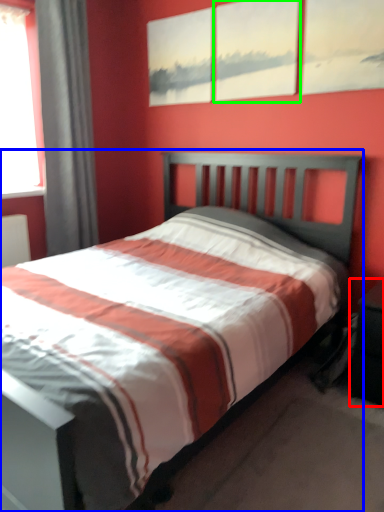
Question: Which is nearer to the nightstand (highlighted by a red box)? bed (highlighted by a blue box) or picture frame (highlighted by a green box).

Choices:
 (A) bed
 (B) picture frame

Answer: (A)